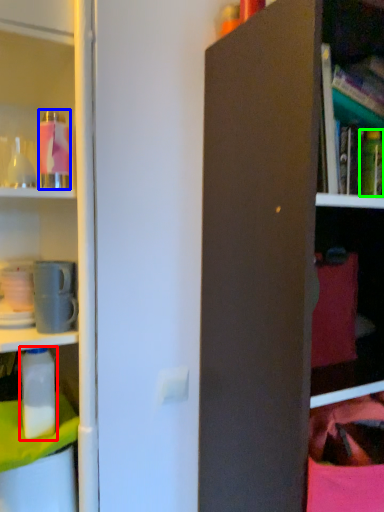
Question: Which object is the farthest from bottle (highlighted by a red box)? Choose among these: bottle (highlighted by a blue box) or bottle (highlighted by a green box).

Choices:
 (A) bottle
 (B) bottle

Answer: (B)